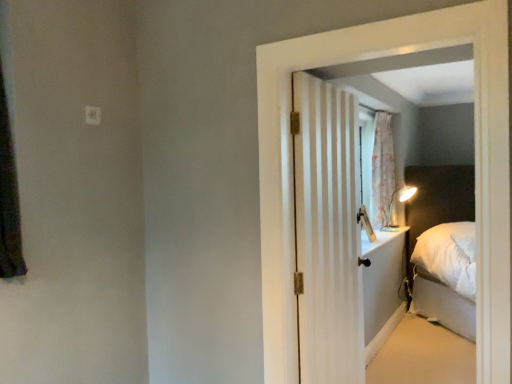
Question: Would you say white plastic electrical outlet at upper left is outside white striped door at center?

Choices:
 (A) no
 (B) yes

Answer: (B)

Question: From the image's perspective, would you say white plastic electrical outlet at upper left is positioned over white striped door at center?

Choices:
 (A) yes
 (B) no

Answer: (A)

Question: Is the position of white plastic electrical outlet at upper left more distant than that of white striped door at center?

Choices:
 (A) no
 (B) yes

Answer: (B)

Question: Does white plastic electrical outlet at upper left have a greater width compared to white striped door at center?

Choices:
 (A) yes
 (B) no

Answer: (B)

Question: Is white plastic electrical outlet at upper left positioned before white striped door at center?

Choices:
 (A) yes
 (B) no

Answer: (B)

Question: From the image's perspective, is white plastic electrical outlet at upper left below white striped door at center?

Choices:
 (A) yes
 (B) no

Answer: (B)

Question: Can you confirm if white striped door at center is smaller than white plastic electrical outlet at upper left?

Choices:
 (A) no
 (B) yes

Answer: (A)

Question: Could you tell me if white striped door at center is turned towards white plastic electrical outlet at upper left?

Choices:
 (A) no
 (B) yes

Answer: (A)

Question: Is white striped door at center positioned far away from white plastic electrical outlet at upper left?

Choices:
 (A) yes
 (B) no

Answer: (A)

Question: Is white striped door at center taller than white plastic electrical outlet at upper left?

Choices:
 (A) yes
 (B) no

Answer: (A)

Question: From the image's perspective, is white striped door at center over white plastic electrical outlet at upper left?

Choices:
 (A) no
 (B) yes

Answer: (A)

Question: Considering the relative sizes of white striped door at center and white plastic electrical outlet at upper left in the image provided, is white striped door at center bigger than white plastic electrical outlet at upper left?

Choices:
 (A) yes
 (B) no

Answer: (A)

Question: Looking at their shapes, would you say white plastic electrical outlet at upper left is wider or thinner than white striped door at center?

Choices:
 (A) thin
 (B) wide

Answer: (A)